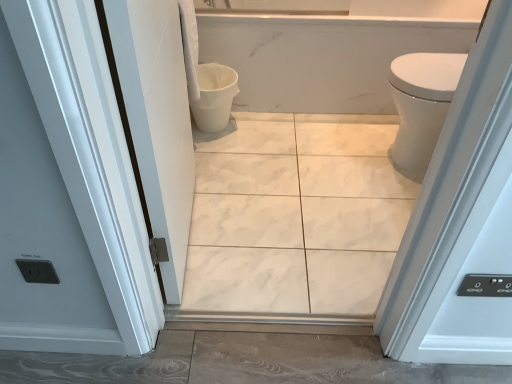
In order to click on free space between white glossy door at left and white matte toilet bowl at center in this screenshot , I will do `click(207, 187)`.